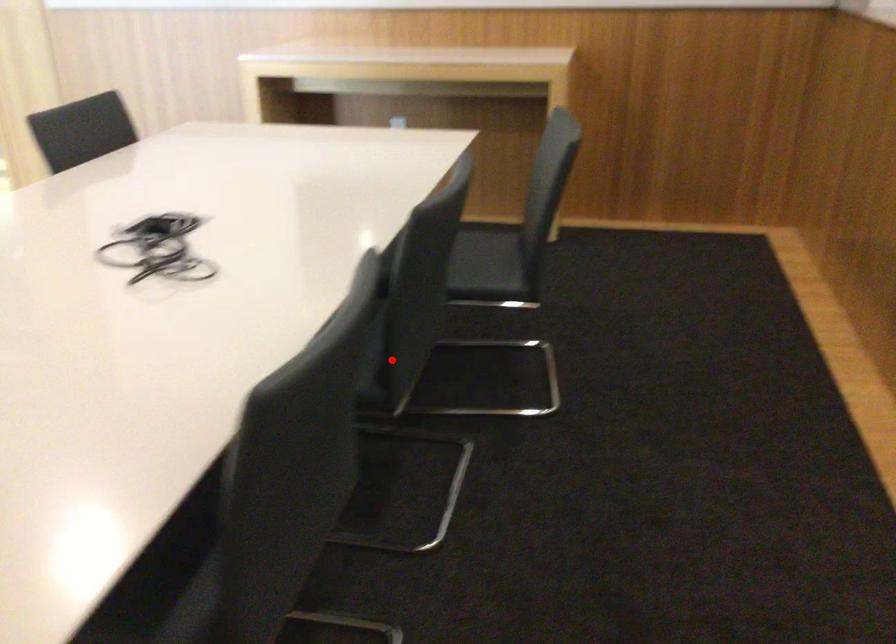
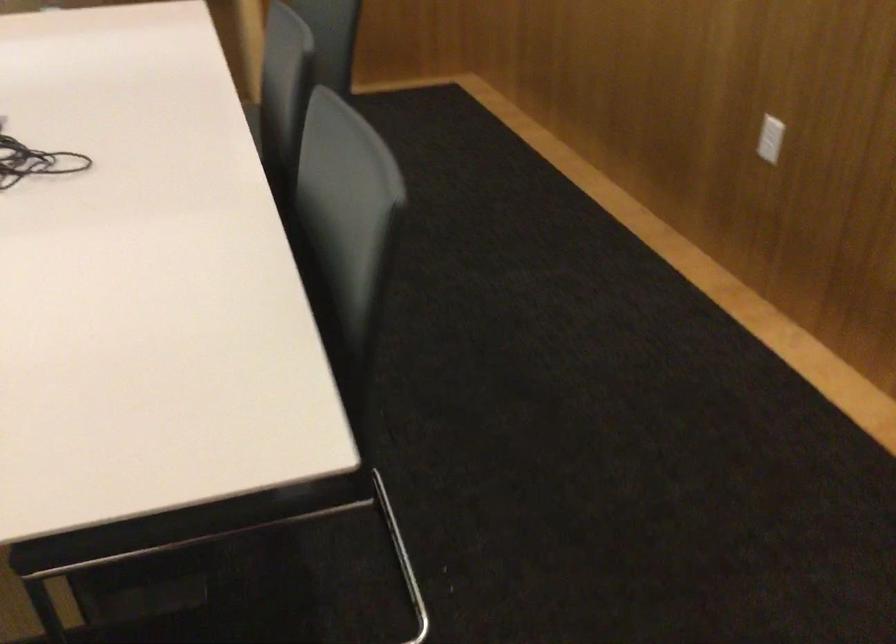
Question: I am providing you with two images of the same scene from different viewpoints. A red point is marked on the first image. Can you still see the location of the red point in image 2?

Choices:
 (A) Yes
 (B) No

Answer: (B)